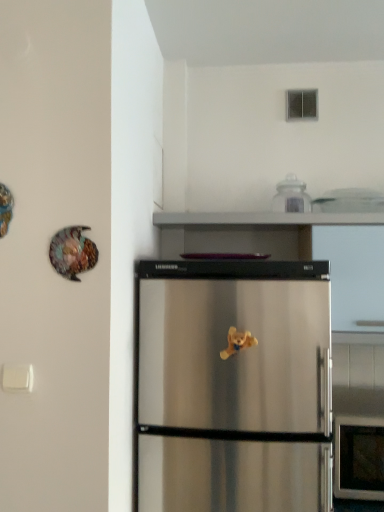
Question: Considering the positions of yellow plush bear at center and clear glass jar at upper center in the image, is yellow plush bear at center wider or thinner than clear glass jar at upper center?

Choices:
 (A) wide
 (B) thin

Answer: (B)

Question: Is yellow plush bear at center bigger or smaller than clear glass jar at upper center?

Choices:
 (A) big
 (B) small

Answer: (B)

Question: Which of these objects is positioned farthest from the shiny metallic plate at upper left?

Choices:
 (A) yellow plush bear at center
 (B) clear glass jar at upper center

Answer: (B)

Question: Based on their relative distances, which object is nearer to the clear glass jar at upper center?

Choices:
 (A) yellow plush bear at center
 (B) shiny metallic plate at upper left

Answer: (A)